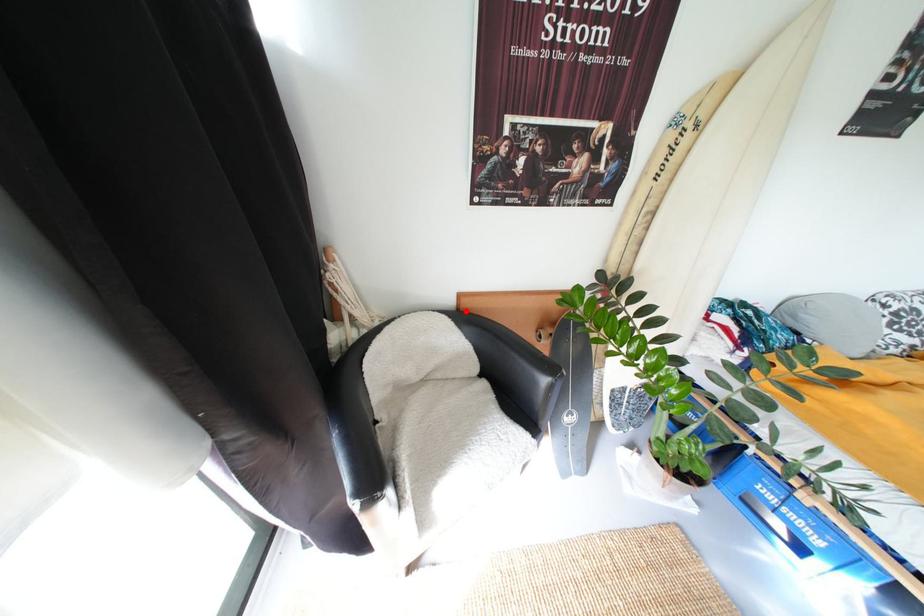
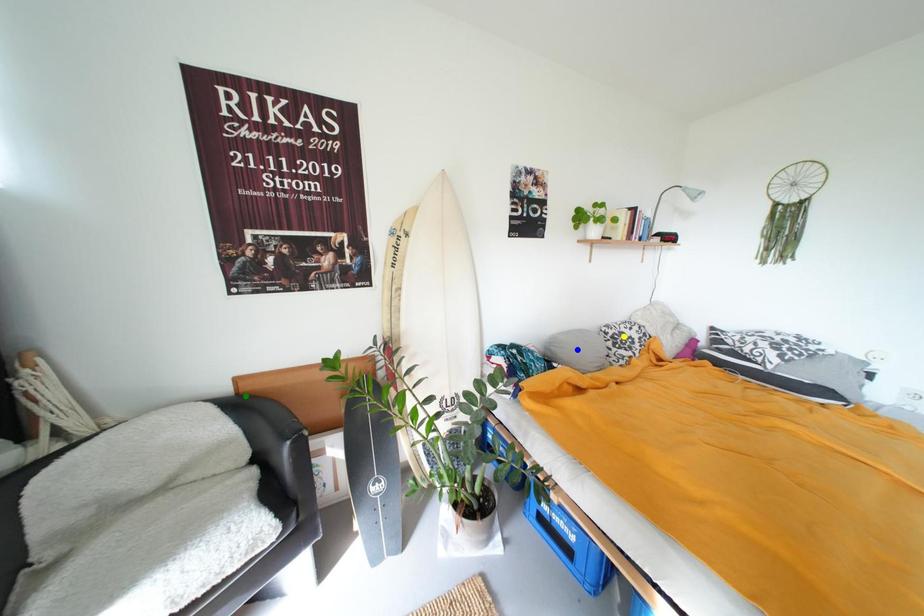
Question: I am providing you with two images of the same scene from different viewpoints. A red point is marked on the first image. You are given multiple points on the second image. Can you choose the point in image 2 that corresponds to the point in image 1?

Choices:
 (A) blue point
 (B) green point
 (C) yellow point

Answer: (B)